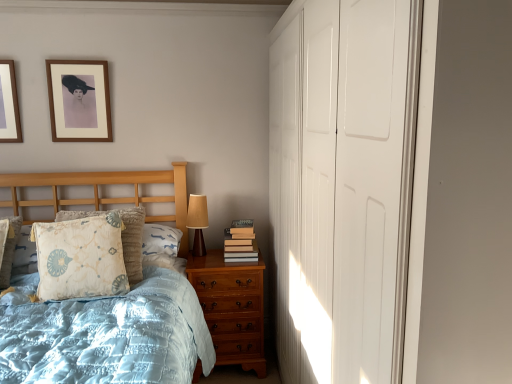
Question: Can we say wooden picture frame at upper left, the first picture frame from the right, lies outside white glossy closet doors at right?

Choices:
 (A) no
 (B) yes

Answer: (B)

Question: Could you tell me if wooden picture frame at upper left, arranged as the 2th picture frame when viewed from the left, is turned towards white glossy closet doors at right?

Choices:
 (A) no
 (B) yes

Answer: (A)

Question: Considering the relative sizes of wooden picture frame at upper left, arranged as the 2th picture frame when viewed from the left, and white glossy closet doors at right in the image provided, is wooden picture frame at upper left, arranged as the 2th picture frame when viewed from the left, taller than white glossy closet doors at right?

Choices:
 (A) yes
 (B) no

Answer: (B)

Question: Is wooden picture frame at upper left, arranged as the 2th picture frame when viewed from the left, shorter than white glossy closet doors at right?

Choices:
 (A) no
 (B) yes

Answer: (B)

Question: From a real-world perspective, does wooden picture frame at upper left, arranged as the 2th picture frame when viewed from the left, stand above white glossy closet doors at right?

Choices:
 (A) yes
 (B) no

Answer: (A)

Question: Does point (198, 372) appear closer or farther from the camera than point (373, 306)?

Choices:
 (A) closer
 (B) farther

Answer: (B)

Question: From the image's perspective, is light blue quilted bed at left positioned above or below white glossy closet doors at right?

Choices:
 (A) below
 (B) above

Answer: (A)

Question: Is light blue quilted bed at left taller or shorter than white glossy closet doors at right?

Choices:
 (A) tall
 (B) short

Answer: (B)

Question: Based on their positions, is light blue quilted bed at left located to the left or right of white glossy closet doors at right?

Choices:
 (A) left
 (B) right

Answer: (A)

Question: Is wooden picture frame at upper left, the first picture frame from the right, inside the boundaries of matte wood picture frame at upper left, acting as the 1th picture frame starting from the left, or outside?

Choices:
 (A) outside
 (B) inside

Answer: (A)

Question: Is wooden picture frame at upper left, the first picture frame from the right, in front of or behind matte wood picture frame at upper left, acting as the 1th picture frame starting from the left, in the image?

Choices:
 (A) behind
 (B) front

Answer: (A)

Question: Is point (52, 59) closer or farther from the camera than point (13, 71)?

Choices:
 (A) closer
 (B) farther

Answer: (B)

Question: In terms of size, does wooden picture frame at upper left, arranged as the 2th picture frame when viewed from the left, appear bigger or smaller than matte wood picture frame at upper left, which is counted as the second picture frame, starting from the right?

Choices:
 (A) big
 (B) small

Answer: (A)

Question: Considering the positions of matte brown wood table lamp at right and floral-patterned fabric pillow at left in the image, is matte brown wood table lamp at right wider or thinner than floral-patterned fabric pillow at left?

Choices:
 (A) thin
 (B) wide

Answer: (A)

Question: In the image, is matte brown wood table lamp at right positioned in front of or behind floral-patterned fabric pillow at left?

Choices:
 (A) behind
 (B) front

Answer: (A)